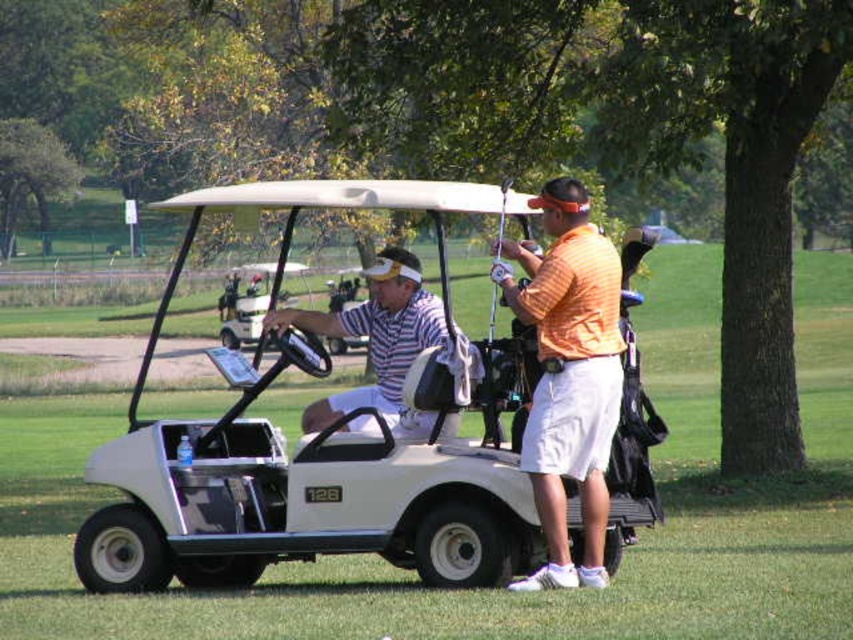
Question: Observing the image, what is the correct spatial positioning of white matte golf cart at center in reference to striped cotton shirt at center?

Choices:
 (A) below
 (B) above

Answer: (B)

Question: Which object appears farthest from the camera in this image?

Choices:
 (A) white matte golf cart at center
 (B) striped cotton shirt at center
 (C) orange matte shirt at center

Answer: (B)

Question: Does orange matte shirt at center have a lesser width compared to striped cotton shirt at center?

Choices:
 (A) no
 (B) yes

Answer: (B)

Question: Which point is farther to the camera?

Choices:
 (A) white matte golf cart at center
 (B) orange matte shirt at center

Answer: (B)

Question: Does white matte golf cart at center have a greater width compared to striped cotton shirt at center?

Choices:
 (A) yes
 (B) no

Answer: (A)

Question: Estimate the real-world distances between objects in this image. Which object is farther from the striped cotton shirt at center?

Choices:
 (A) orange matte shirt at center
 (B) white matte golf cart at center

Answer: (A)